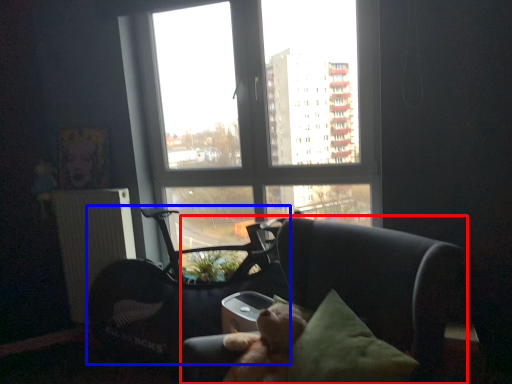
Question: Which point is further to the camera, chair (highlighted by a red box) or swivel chair (highlighted by a blue box)?

Choices:
 (A) chair
 (B) swivel chair

Answer: (B)